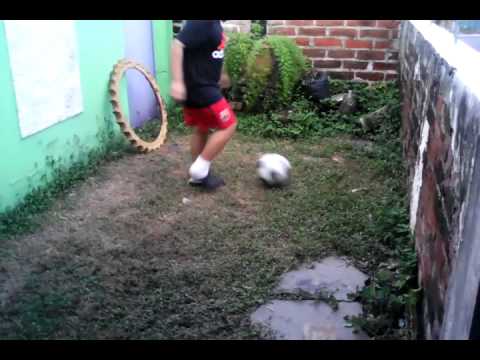
The height and width of the screenshot is (360, 480). Find the location of `slipper`. slipper is located at coordinates (208, 181).